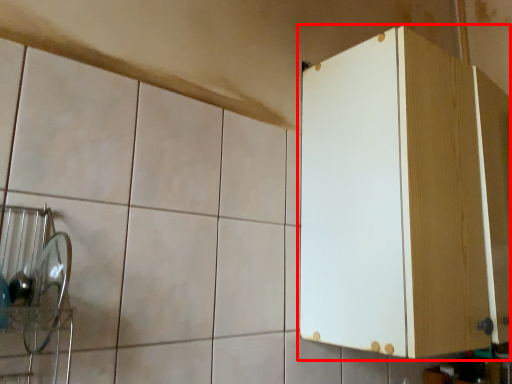
Question: Observing the image, what is the correct spatial positioning of cabinetry (annotated by the red box) in reference to ceramic tile?

Choices:
 (A) left
 (B) right

Answer: (B)